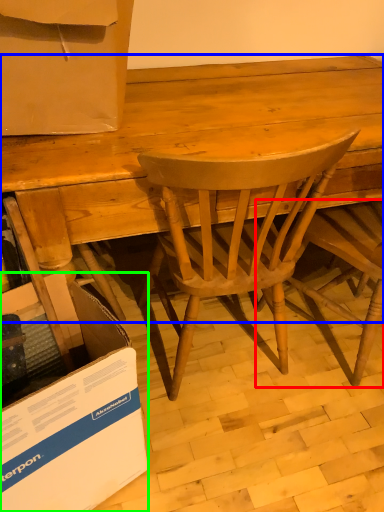
Question: Considering the real-world distances, which object is farthest from chair (highlighted by a red box)? desk (highlighted by a blue box) or cardboard box (highlighted by a green box)?

Choices:
 (A) desk
 (B) cardboard box

Answer: (B)